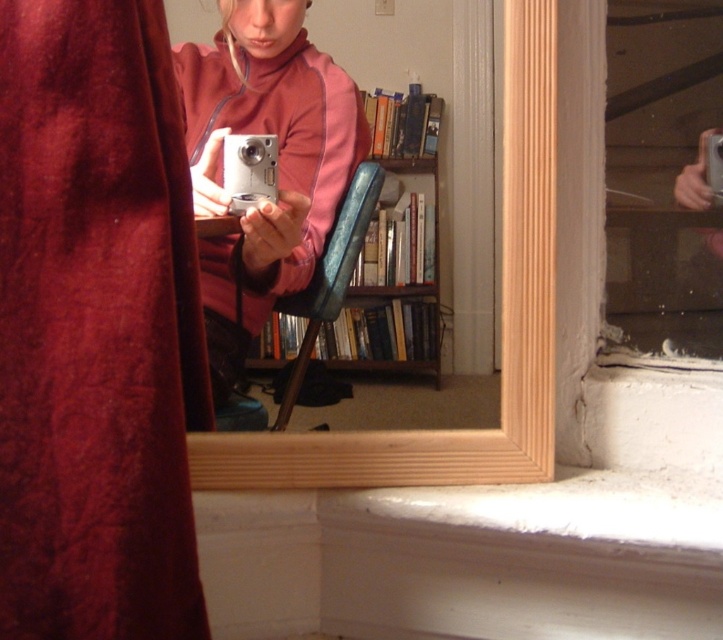
You are a photographer setting up a shot and need to position a pink fabric at center and a wooden bookshelf at center. According to the scene, which object is positioned to the left when viewed from the photographer?

The pink fabric at center is to the left of the wooden bookshelf at center, so the pink fabric at center is positioned to the left.

You are a photographer trying to capture a reflection in the mirror. The pink fabric at center and the wooden bookshelf at center are both visible in the mirror. Which object appears taller in the reflection?

The pink fabric at center appears taller than the wooden bookshelf at center in the reflection because it is much taller as wooden bookshelf at center.